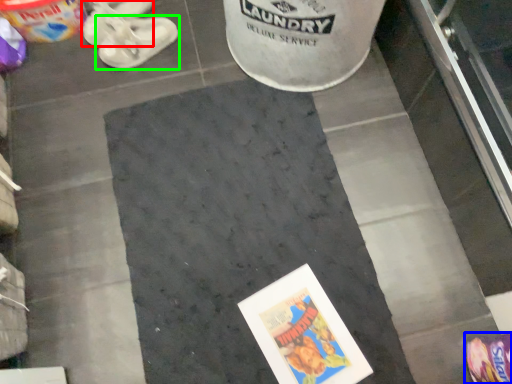
Question: Which object is positioned farthest from footwear (highlighted by a red box)? Select from footwear (highlighted by a blue box) and footwear (highlighted by a green box).

Choices:
 (A) footwear
 (B) footwear

Answer: (A)